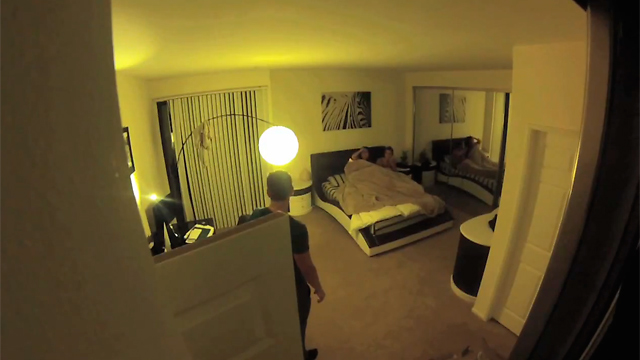
I want to click on artwork, so click(130, 151), click(349, 114).